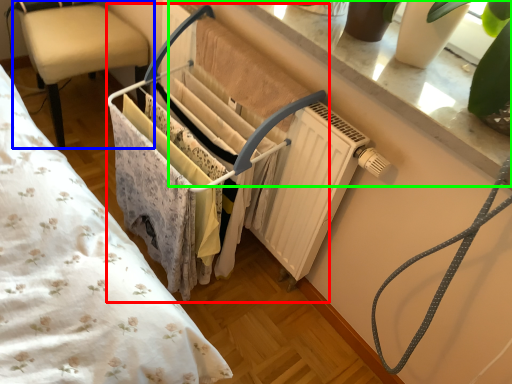
Question: Based on their relative distances, which object is nearer to closet (highlighted by a red box)? Choose from chair (highlighted by a blue box) and window sill (highlighted by a green box).

Choices:
 (A) chair
 (B) window sill

Answer: (B)